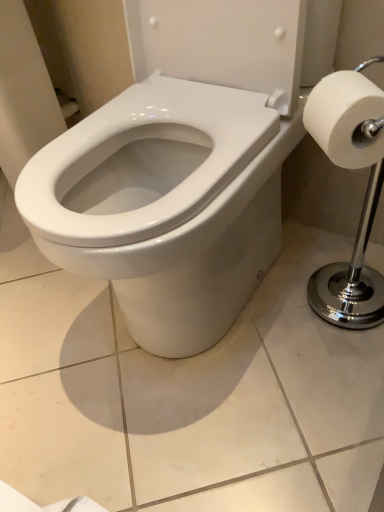
The height and width of the screenshot is (512, 384). What do you see at coordinates (347, 119) in the screenshot?
I see `white matte toilet paper at right` at bounding box center [347, 119].

Where is `white matte toilet paper at right`? white matte toilet paper at right is located at coordinates (347, 119).

In order to face white glossy bidet at center, should I rotate leftwards or rightwards?

Turn left by 1.308 degrees to look at white glossy bidet at center.

Describe the element at coordinates (166, 205) in the screenshot. I see `white glossy bidet at center` at that location.

Where is `white glossy bidet at center`? The image size is (384, 512). white glossy bidet at center is located at coordinates (166, 205).

Identify the location of white matte toilet paper at right. (347, 119).

Would you say white matte toilet paper at right is to the left or to the right of white glossy bidet at center in the picture?

Based on their positions, white matte toilet paper at right is located to the right of white glossy bidet at center.

Considering the relative positions of white matte toilet paper at right and white glossy bidet at center in the image provided, is white matte toilet paper at right in front of white glossy bidet at center?

No, white matte toilet paper at right is further to the viewer.

Which is nearer, (357,165) or (208,174)?

Point (357,165) is farther from the camera than point (208,174).

From the image's perspective, between white matte toilet paper at right and white glossy bidet at center, who is located below?

From the image's view, white glossy bidet at center is below.

From a real-world perspective, is white matte toilet paper at right located beneath white glossy bidet at center?

Actually, white matte toilet paper at right is physically above white glossy bidet at center in the real world.

Which object is wider, white matte toilet paper at right or white glossy bidet at center?

white glossy bidet at center is wider.

Considering the sizes of objects white matte toilet paper at right and white glossy bidet at center in the image provided, who is taller, white matte toilet paper at right or white glossy bidet at center?

Standing taller between the two is white glossy bidet at center.

Does white matte toilet paper at right have a smaller size compared to white glossy bidet at center?

Indeed, white matte toilet paper at right has a smaller size compared to white glossy bidet at center.

Is white matte toilet paper at right surrounding white glossy bidet at center?

No.

Is white matte toilet paper at right positioned far away from white glossy bidet at center?

No.

Is white matte toilet paper at right positioned with its back to white glossy bidet at center?

No, white matte toilet paper at right is not facing the opposite direction of white glossy bidet at center.

What's the angular difference between white matte toilet paper at right and white glossy bidet at center's facing directions?

There is a 44.1-degree angle between the facing directions of white matte toilet paper at right and white glossy bidet at center.

How distant is white matte toilet paper at right from white glossy bidet at center?

They are 11.86 inches apart.

Locate an element on the screen. The image size is (384, 512). bidet on the left of white matte toilet paper at right is located at coordinates (166, 205).

Considering the positions of objects white glossy bidet at center and white matte toilet paper at right in the image provided, who is more to the left, white glossy bidet at center or white matte toilet paper at right?

Positioned to the left is white glossy bidet at center.

Is white glossy bidet at center positioned behind white matte toilet paper at right?

No, white glossy bidet at center is closer to the camera.

Is point (138, 254) less distant than point (339, 162)?

Yes.

Consider the image. From the image's perspective, which one is positioned higher, white glossy bidet at center or white matte toilet paper at right?

white matte toilet paper at right appears higher in the image.

From a real-world perspective, is white glossy bidet at center beneath white matte toilet paper at right?

Correct, in the physical world, white glossy bidet at center is lower than white matte toilet paper at right.

Considering the sizes of objects white glossy bidet at center and white matte toilet paper at right in the image provided, who is wider, white glossy bidet at center or white matte toilet paper at right?

Wider between the two is white glossy bidet at center.

From their relative heights in the image, would you say white glossy bidet at center is taller or shorter than white matte toilet paper at right?

In the image, white glossy bidet at center appears to be taller than white matte toilet paper at right.

Can you confirm if white glossy bidet at center is bigger than white matte toilet paper at right?

Yes, white glossy bidet at center is bigger than white matte toilet paper at right.

Is white glossy bidet at center inside the boundaries of white matte toilet paper at right, or outside?

white glossy bidet at center is not enclosed by white matte toilet paper at right.

Would you say white glossy bidet at center is a long distance from white matte toilet paper at right?

No, white glossy bidet at center is not far from white matte toilet paper at right.

Is white glossy bidet at center oriented towards white matte toilet paper at right?

No, white glossy bidet at center is not facing towards white matte toilet paper at right.

This screenshot has height=512, width=384. What are the coordinates of `bidet located below the white matte toilet paper at right (from the image's perspective)` in the screenshot? It's located at (166, 205).

I want to click on toilet paper lying on the right of white glossy bidet at center, so click(x=347, y=119).

In order to click on toilet paper lying behind the white glossy bidet at center in this screenshot , I will do `click(347, 119)`.